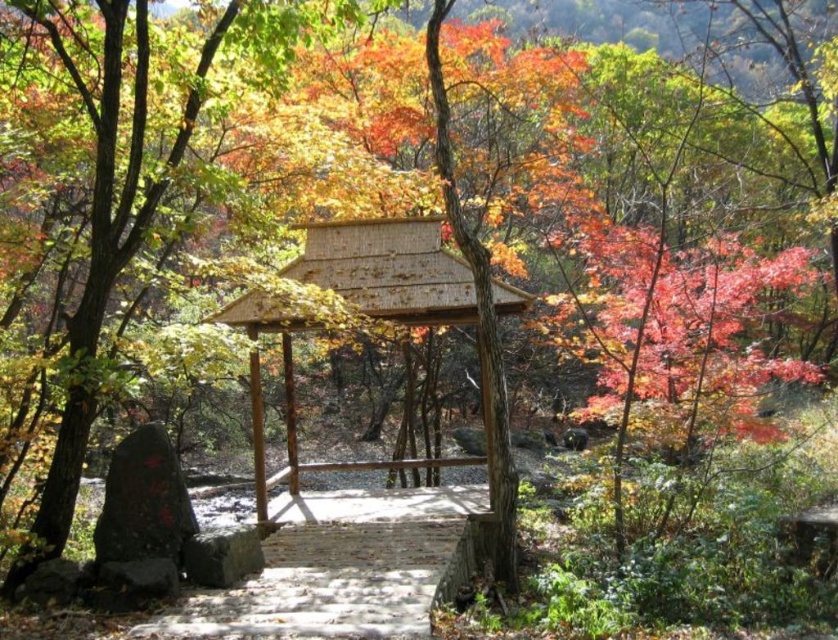
Does white stone path at center appear under wooden gazebo at center?

Correct, white stone path at center is located below wooden gazebo at center.

How much distance is there between white stone path at center and wooden gazebo at center?

2.89 meters

Is point (428, 506) farther from camera compared to point (500, 307)?

Yes, it is.

The height and width of the screenshot is (640, 838). What are the coordinates of `white stone path at center` in the screenshot? It's located at (337, 568).

Measure the distance between point (35,545) and camera.

They are 22.74 feet apart.

Describe the element at coordinates (104, 246) in the screenshot. Image resolution: width=838 pixels, height=640 pixels. I see `smooth brown wooden gazebo at center` at that location.

What are the coordinates of `smooth brown wooden gazebo at center` in the screenshot? It's located at click(x=104, y=246).

Does smooth brown wooden gazebo at center have a lesser height compared to wooden gazebo at center?

In fact, smooth brown wooden gazebo at center may be taller than wooden gazebo at center.

Is smooth brown wooden gazebo at center positioned before wooden gazebo at center?

That is True.

The height and width of the screenshot is (640, 838). Describe the element at coordinates (104, 246) in the screenshot. I see `smooth brown wooden gazebo at center` at that location.

The height and width of the screenshot is (640, 838). I want to click on smooth brown wooden gazebo at center, so click(x=104, y=246).